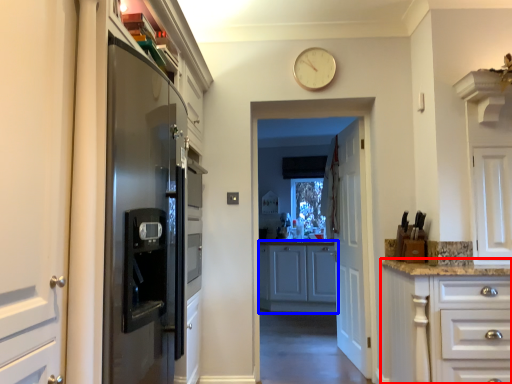
Question: Which point is further to the camera, cabinetry (highlighted by a red box) or cabinetry (highlighted by a blue box)?

Choices:
 (A) cabinetry
 (B) cabinetry

Answer: (B)